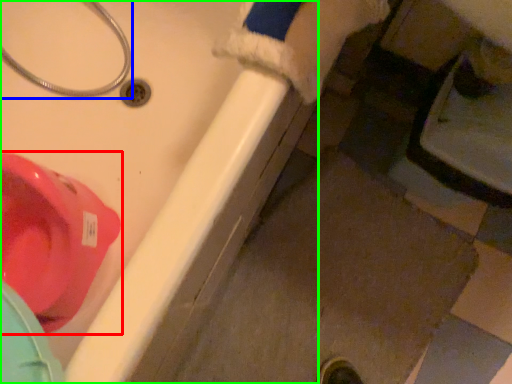
Question: Estimate the real-world distances between objects in this image. Which object is farther from toilet (highlighted by a red box), plumbing fixture (highlighted by a blue box) or bath (highlighted by a green box)?

Choices:
 (A) plumbing fixture
 (B) bath

Answer: (A)